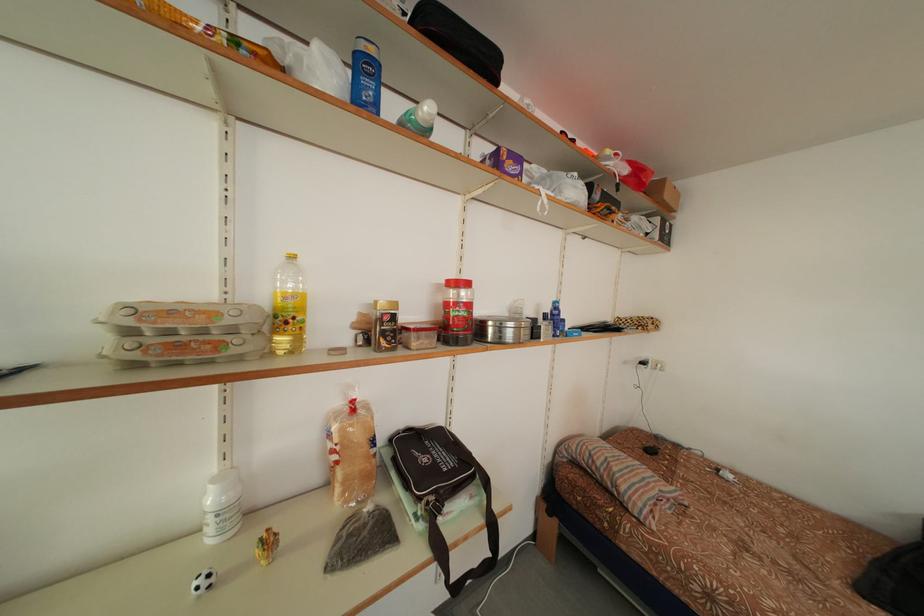
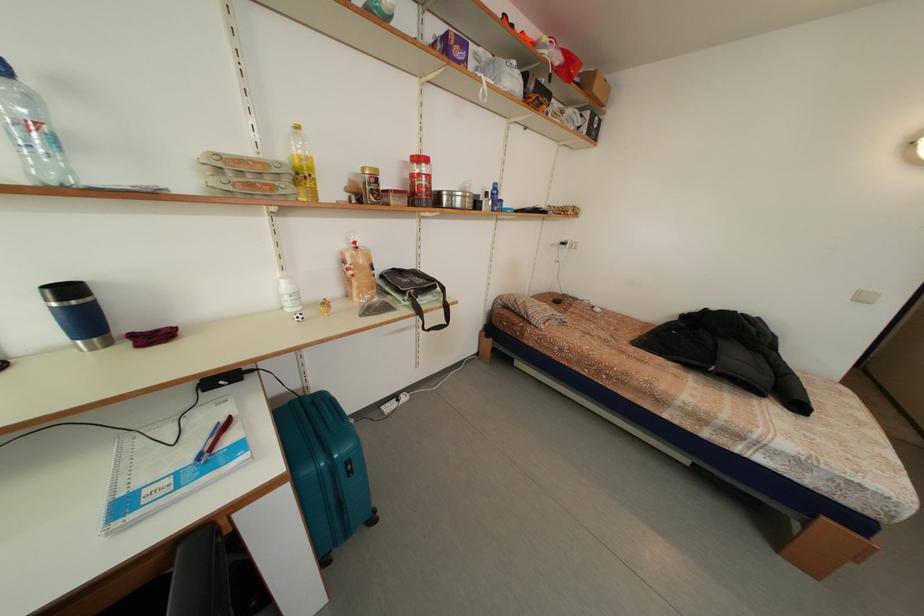
Locate, in the second image, the point that corresponds to (x=396, y=347) in the first image.

(383, 204)